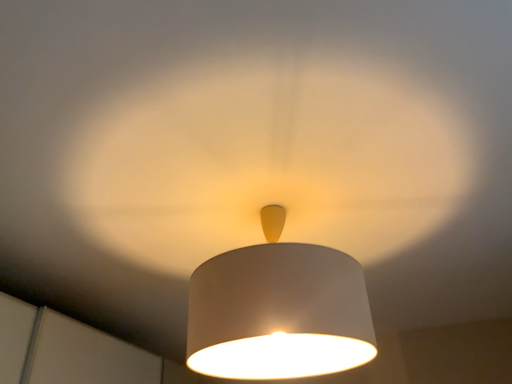
Describe the element at coordinates (278, 310) in the screenshot. I see `white matte lampshade at center` at that location.

What are the coordinates of `white matte lampshade at center` in the screenshot? It's located at (278, 310).

You are a GUI agent. You are given a task and a screenshot of the screen. Output one action in this format:
    pyautogui.click(x=<x>, y=<y>)
    Task: Click on the matte white lampshade at center
    The height and width of the screenshot is (384, 512).
    Given the screenshot: What is the action you would take?
    pyautogui.click(x=268, y=160)

In order to face matte white lampshade at center, should I rotate leftwards or rightwards?

You should look left and rotate roughly 0.076 degrees.

Describe the element at coordinates (268, 160) in the screenshot. I see `matte white lampshade at center` at that location.

What is the approximate height of matte white lampshade at center?

matte white lampshade at center is 2.04 inches tall.

Where is `white matte lampshade at center`? white matte lampshade at center is located at coordinates (278, 310).

Is matte white lampshade at center at the right side of white matte lampshade at center?

Incorrect, matte white lampshade at center is not on the right side of white matte lampshade at center.

Who is more distant, matte white lampshade at center or white matte lampshade at center?

white matte lampshade at center is behind.

Is point (273, 182) closer to viewer compared to point (269, 375)?

Yes, it is.

Looking at this image, from the image's perspective, is matte white lampshade at center beneath white matte lampshade at center?

Correct, matte white lampshade at center appears lower than white matte lampshade at center in the image.

From a real-world perspective, does matte white lampshade at center sit lower than white matte lampshade at center?

No.

Is matte white lampshade at center thinner than white matte lampshade at center?

No.

Is matte white lampshade at center taller or shorter than white matte lampshade at center?

Clearly, matte white lampshade at center is shorter compared to white matte lampshade at center.

Who is bigger, matte white lampshade at center or white matte lampshade at center?

With larger size is matte white lampshade at center.

Choose the correct answer: Is matte white lampshade at center inside white matte lampshade at center or outside it?

The correct answer is: outside.

Is matte white lampshade at center positioned far away from white matte lampshade at center?

No, there isn't a large distance between matte white lampshade at center and white matte lampshade at center.

Does matte white lampshade at center turn towards white matte lampshade at center?

No, matte white lampshade at center is not turned towards white matte lampshade at center.

In the scene shown: How different are the orientations of matte white lampshade at center and white matte lampshade at center in degrees?

1.25 degrees separate the facing orientations of matte white lampshade at center and white matte lampshade at center.

This screenshot has height=384, width=512. Find the location of `lamp located on the right of matte white lampshade at center`. lamp located on the right of matte white lampshade at center is located at coordinates (278, 310).

Between white matte lampshade at center and matte white lampshade at center, which one appears on the right side from the viewer's perspective?

From the viewer's perspective, white matte lampshade at center appears more on the right side.

Is white matte lampshade at center in front of or behind matte white lampshade at center in the image?

white matte lampshade at center is positioned farther from the viewer than matte white lampshade at center.

Which is in front, point (334, 367) or point (184, 102)?

The point (184, 102) is closer.

From the image's perspective, is white matte lampshade at center below matte white lampshade at center?

No, from the image's perspective, white matte lampshade at center is not beneath matte white lampshade at center.

From the picture: From a real-world perspective, who is located higher, white matte lampshade at center or matte white lampshade at center?

matte white lampshade at center.

Considering the relative sizes of white matte lampshade at center and matte white lampshade at center in the image provided, is white matte lampshade at center wider than matte white lampshade at center?

Incorrect, the width of white matte lampshade at center does not surpass that of matte white lampshade at center.

Can you confirm if white matte lampshade at center is shorter than matte white lampshade at center?

In fact, white matte lampshade at center may be taller than matte white lampshade at center.

Looking at the image, does white matte lampshade at center seem bigger or smaller compared to matte white lampshade at center?

white matte lampshade at center is smaller than matte white lampshade at center.

Choose the correct answer: Is white matte lampshade at center inside matte white lampshade at center or outside it?

white matte lampshade at center is outside matte white lampshade at center.

Does white matte lampshade at center touch matte white lampshade at center?

No, white matte lampshade at center is not beside matte white lampshade at center.

Is matte white lampshade at center at the back of white matte lampshade at center?

No, white matte lampshade at center is not facing away from matte white lampshade at center.

How many degrees apart are the facing directions of white matte lampshade at center and matte white lampshade at center?

They differ by 1.25 degrees in their facing directions.

How much distance is there between white matte lampshade at center and matte white lampshade at center?

The distance of white matte lampshade at center from matte white lampshade at center is 37.92 centimeters.

Image resolution: width=512 pixels, height=384 pixels. What are the coordinates of `glow that is on the left side of white matte lampshade at center` in the screenshot? It's located at (268, 160).

Image resolution: width=512 pixels, height=384 pixels. Identify the location of lamp lying behind the matte white lampshade at center. (278, 310).

Locate an element on the screen. Image resolution: width=512 pixels, height=384 pixels. lamp below the matte white lampshade at center (from a real-world perspective) is located at coordinates point(278,310).